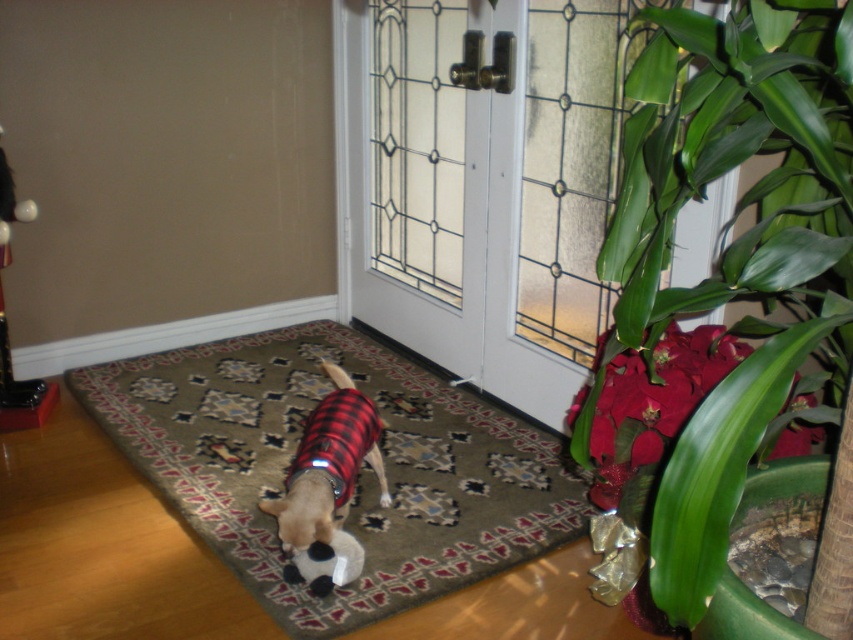
Question: Estimate the real-world distances between objects in this image. Which object is closer to the carpeted rug at center?

Choices:
 (A) green leafy plant at right
 (B) plaid fabric dog at center
 (C) metallic silver figurine at left

Answer: (B)

Question: Among these objects, which one is farthest from the camera?

Choices:
 (A) green leafy plant at right
 (B) carpeted rug at center
 (C) metallic silver figurine at left

Answer: (C)

Question: Observing the image, what is the correct spatial positioning of carpeted rug at center in reference to plaid fabric dog at center?

Choices:
 (A) left
 (B) right

Answer: (A)

Question: In this image, where is green leafy plant at right located relative to plaid fabric dog at center?

Choices:
 (A) below
 (B) above

Answer: (B)

Question: Which of the following is the farthest from the observer?

Choices:
 (A) (294, 468)
 (B) (543, 552)
 (C) (3, 317)
 (D) (828, 108)

Answer: (C)

Question: Does green leafy plant at right appear on the left side of plaid fabric dog at center?

Choices:
 (A) no
 (B) yes

Answer: (A)